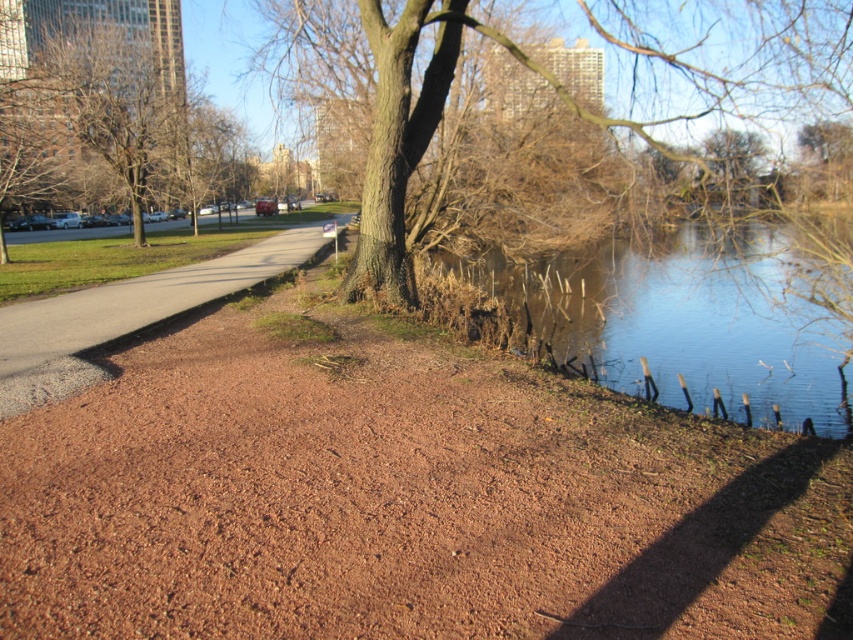
Locate an element on the screen. brown dirt path at center is located at coordinates (398, 493).

Between brown dirt path at center and brown gravel path at left, which one appears on the right side from the viewer's perspective?

brown dirt path at center is more to the right.

Locate an element on the screen. brown dirt path at center is located at coordinates tap(398, 493).

What are the coordinates of `bare wood tree at upper left` in the screenshot? It's located at (107, 109).

Does bare wood tree at upper left appear under brown gravel path at left?

No.

Find the location of a particular element. The image size is (853, 640). bare wood tree at upper left is located at coordinates (107, 109).

The image size is (853, 640). I want to click on bare wood tree at upper left, so click(x=107, y=109).

Does point (804, 67) come farther from viewer compared to point (4, 417)?

Yes, point (804, 67) is behind point (4, 417).

Who is positioned more to the right, brown rough bark tree at center or brown gravel path at left?

brown rough bark tree at center

Is point (828, 99) positioned behind point (59, 388)?

Yes, point (828, 99) is farther from viewer.

At what (x,y) coordinates should I click in order to perform the action: click on brown rough bark tree at center. Please return your answer as a coordinate pair (x, y). Image resolution: width=853 pixels, height=640 pixels. Looking at the image, I should click on (730, 58).